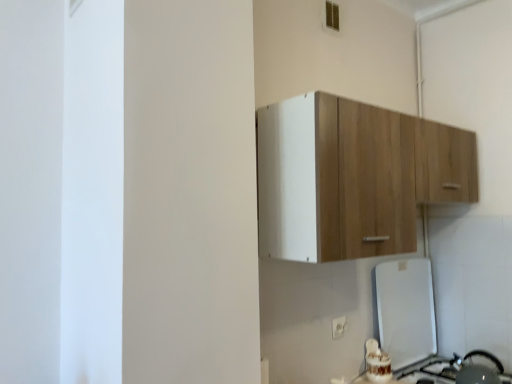
The image size is (512, 384). I want to click on wooden cabinet at upper center, so click(353, 177).

Measure the distance between point (380,329) and camera.

The distance of point (380,329) from camera is 6.61 feet.

The height and width of the screenshot is (384, 512). I want to click on white plastic electric outlet at lower center, so click(x=338, y=327).

Identify the location of metallic silver kettle at lower right, arranged as the 2th appliance when viewed from the top. This screenshot has width=512, height=384. (476, 369).

Is white plastic electric outlet at lower center turned away from wooden cabinet at upper center?

No, white plastic electric outlet at lower center is not facing the opposite direction of wooden cabinet at upper center.

Visually, is white plastic electric outlet at lower center positioned to the left or to the right of wooden cabinet at upper center?

Based on their positions, white plastic electric outlet at lower center is located to the left of wooden cabinet at upper center.

Consider the image. Do you think white plastic electric outlet at lower center is within wooden cabinet at upper center, or outside of it?

white plastic electric outlet at lower center is outside wooden cabinet at upper center.

In the scene shown: What's the angular difference between white plastic electric outlet at lower center and wooden cabinet at upper center's facing directions?

The facing directions of white plastic electric outlet at lower center and wooden cabinet at upper center are 1.02 degrees apart.

Can you confirm if wooden cabinet at upper center is positioned to the left of metallic silver kettle at lower right, the 1th appliance from the bottom?

Yes, wooden cabinet at upper center is to the left of metallic silver kettle at lower right, the 1th appliance from the bottom.

Is wooden cabinet at upper center oriented away from metallic silver kettle at lower right, arranged as the 2th appliance when viewed from the top?

wooden cabinet at upper center is not turned away from metallic silver kettle at lower right, arranged as the 2th appliance when viewed from the top.

From the image's perspective, is wooden cabinet at upper center over metallic silver kettle at lower right, arranged as the 2th appliance when viewed from the top?

Correct, wooden cabinet at upper center appears higher than metallic silver kettle at lower right, arranged as the 2th appliance when viewed from the top, in the image.

Looking at this image, does wooden cabinet at upper center lie in front of metallic silver kettle at lower right, arranged as the 2th appliance when viewed from the top?

Yes, it is.

Would you say white glossy refrigerator at lower right, acting as the 2th appliance starting from the bottom, is inside or outside metallic silver kettle at lower right, arranged as the 2th appliance when viewed from the top?

white glossy refrigerator at lower right, acting as the 2th appliance starting from the bottom, exists outside the volume of metallic silver kettle at lower right, arranged as the 2th appliance when viewed from the top.

Identify the location of appliance above the metallic silver kettle at lower right, the 1th appliance from the bottom (from a real-world perspective). The image size is (512, 384). (405, 311).

Which of these two, white glossy refrigerator at lower right, acting as the 2th appliance starting from the bottom, or metallic silver kettle at lower right, arranged as the 2th appliance when viewed from the top, is smaller?

Smaller between the two is metallic silver kettle at lower right, arranged as the 2th appliance when viewed from the top.

Are metallic silver kettle at lower right, the 1th appliance from the bottom, and white glossy refrigerator at lower right, acting as the 2th appliance starting from the bottom, located far from each other?

No, metallic silver kettle at lower right, the 1th appliance from the bottom, is in close proximity to white glossy refrigerator at lower right, acting as the 2th appliance starting from the bottom.

Which point is more forward, (458,379) or (435,325)?

The point (458,379) is closer to the camera.

From a real-world perspective, is metallic silver kettle at lower right, the 1th appliance from the bottom, above or below white glossy refrigerator at lower right, acting as the 2th appliance starting from the bottom?

From a real-world perspective, metallic silver kettle at lower right, the 1th appliance from the bottom, is physically below white glossy refrigerator at lower right, acting as the 2th appliance starting from the bottom.

I want to click on appliance that appears behind the white glossy refrigerator at lower right, which is the first appliance from top to bottom, so click(x=476, y=369).

From a real-world perspective, is metallic silver kettle at lower right, arranged as the 2th appliance when viewed from the top, on top of wooden cabinet at upper center?

Incorrect, from a real-world perspective, metallic silver kettle at lower right, arranged as the 2th appliance when viewed from the top, is lower than wooden cabinet at upper center.

Between metallic silver kettle at lower right, the 1th appliance from the bottom, and wooden cabinet at upper center, which one is positioned behind?

metallic silver kettle at lower right, the 1th appliance from the bottom.

From the image's perspective, which is above, metallic silver kettle at lower right, arranged as the 2th appliance when viewed from the top, or wooden cabinet at upper center?

wooden cabinet at upper center appears higher in the image.

Looking at their sizes, would you say metallic silver kettle at lower right, arranged as the 2th appliance when viewed from the top, is wider or thinner than wooden cabinet at upper center?

In the image, metallic silver kettle at lower right, arranged as the 2th appliance when viewed from the top, appears to be more narrow than wooden cabinet at upper center.

Is white glossy refrigerator at lower right, which is the first appliance from top to bottom, further to the viewer compared to wooden cabinet at upper center?

Yes, it is.

Is white glossy refrigerator at lower right, which is the first appliance from top to bottom, inside or outside of wooden cabinet at upper center?

white glossy refrigerator at lower right, which is the first appliance from top to bottom, is located beyond the bounds of wooden cabinet at upper center.

From the picture: Is white glossy refrigerator at lower right, which is the first appliance from top to bottom, oriented away from wooden cabinet at upper center?

white glossy refrigerator at lower right, which is the first appliance from top to bottom, does not have its back to wooden cabinet at upper center.

Considering the relative sizes of white glossy refrigerator at lower right, acting as the 2th appliance starting from the bottom, and wooden cabinet at upper center in the image provided, is white glossy refrigerator at lower right, acting as the 2th appliance starting from the bottom, smaller than wooden cabinet at upper center?

Correct, white glossy refrigerator at lower right, acting as the 2th appliance starting from the bottom, occupies less space than wooden cabinet at upper center.

Are wooden cabinet at upper center and white glossy refrigerator at lower right, acting as the 2th appliance starting from the bottom, making contact?

wooden cabinet at upper center is not next to white glossy refrigerator at lower right, acting as the 2th appliance starting from the bottom, and they're not touching.

How many degrees apart are the facing directions of wooden cabinet at upper center and white glossy refrigerator at lower right, acting as the 2th appliance starting from the bottom?

0.0647 degrees separate the facing orientations of wooden cabinet at upper center and white glossy refrigerator at lower right, acting as the 2th appliance starting from the bottom.

Which of these two, wooden cabinet at upper center or white glossy refrigerator at lower right, acting as the 2th appliance starting from the bottom, is bigger?

With larger size is wooden cabinet at upper center.

From a real-world perspective, which is physically above, wooden cabinet at upper center or white glossy refrigerator at lower right, acting as the 2th appliance starting from the bottom?

wooden cabinet at upper center.

Where is `cabinetry on the right of white plastic electric outlet at lower center`? cabinetry on the right of white plastic electric outlet at lower center is located at coordinates (353, 177).

Identify the location of appliance that is the 2nd object directly below the wooden cabinet at upper center (from a real-world perspective). (476, 369).

Which object lies further to the anchor point wooden cabinet at upper center, metallic silver kettle at lower right, arranged as the 2th appliance when viewed from the top, or white glossy refrigerator at lower right, which is the first appliance from top to bottom?

metallic silver kettle at lower right, arranged as the 2th appliance when viewed from the top, is further to wooden cabinet at upper center.

Considering their positions, is wooden cabinet at upper center positioned further to white glossy refrigerator at lower right, which is the first appliance from top to bottom, than white plastic electric outlet at lower center?

wooden cabinet at upper center is positioned further to the anchor white glossy refrigerator at lower right, which is the first appliance from top to bottom.

When comparing their distances from metallic silver kettle at lower right, the 1th appliance from the bottom, does white plastic electric outlet at lower center or white glossy refrigerator at lower right, which is the first appliance from top to bottom, seem closer?

Among the two, white glossy refrigerator at lower right, which is the first appliance from top to bottom, is located nearer to metallic silver kettle at lower right, the 1th appliance from the bottom.

From the image, which object appears to be farther from white plastic electric outlet at lower center, wooden cabinet at upper center or white glossy refrigerator at lower right, which is the first appliance from top to bottom?

Based on the image, wooden cabinet at upper center appears to be further to white plastic electric outlet at lower center.

Which object lies nearer to the anchor point metallic silver kettle at lower right, arranged as the 2th appliance when viewed from the top, white glossy refrigerator at lower right, acting as the 2th appliance starting from the bottom, or wooden cabinet at upper center?

white glossy refrigerator at lower right, acting as the 2th appliance starting from the bottom, is closer to metallic silver kettle at lower right, arranged as the 2th appliance when viewed from the top.

Estimate the real-world distances between objects in this image. Which object is closer to white glossy refrigerator at lower right, which is the first appliance from top to bottom, wooden cabinet at upper center or metallic silver kettle at lower right, the 1th appliance from the bottom?

metallic silver kettle at lower right, the 1th appliance from the bottom, is closer to white glossy refrigerator at lower right, which is the first appliance from top to bottom.

Estimate the real-world distances between objects in this image. Which object is further from white plastic electric outlet at lower center, wooden cabinet at upper center or metallic silver kettle at lower right, the 1th appliance from the bottom?

The object further to white plastic electric outlet at lower center is wooden cabinet at upper center.

When comparing their distances from wooden cabinet at upper center, does white plastic electric outlet at lower center or metallic silver kettle at lower right, the 1th appliance from the bottom, seem closer?

The object closer to wooden cabinet at upper center is white plastic electric outlet at lower center.

This screenshot has height=384, width=512. Find the location of `appliance between white plastic electric outlet at lower center and white glossy refrigerator at lower right, which is the first appliance from top to bottom, from left to right`. appliance between white plastic electric outlet at lower center and white glossy refrigerator at lower right, which is the first appliance from top to bottom, from left to right is located at coordinates (476, 369).

At what (x,y) coordinates should I click in order to perform the action: click on appliance between wooden cabinet at upper center and metallic silver kettle at lower right, the 1th appliance from the bottom, in the up-down direction. Please return your answer as a coordinate pair (x, y). Looking at the image, I should click on pos(405,311).

The width and height of the screenshot is (512, 384). In order to click on electric outlet that lies between wooden cabinet at upper center and metallic silver kettle at lower right, the 1th appliance from the bottom, from top to bottom in this screenshot , I will do `click(338, 327)`.

You are a GUI agent. You are given a task and a screenshot of the screen. Output one action in this format:
    pyautogui.click(x=<x>, y=<y>)
    Task: Click on the electric outlet between wooden cabinet at upper center and white glossy refrigerator at lower right, acting as the 2th appliance starting from the bottom, in the up-down direction
    
    Given the screenshot: What is the action you would take?
    pyautogui.click(x=338, y=327)